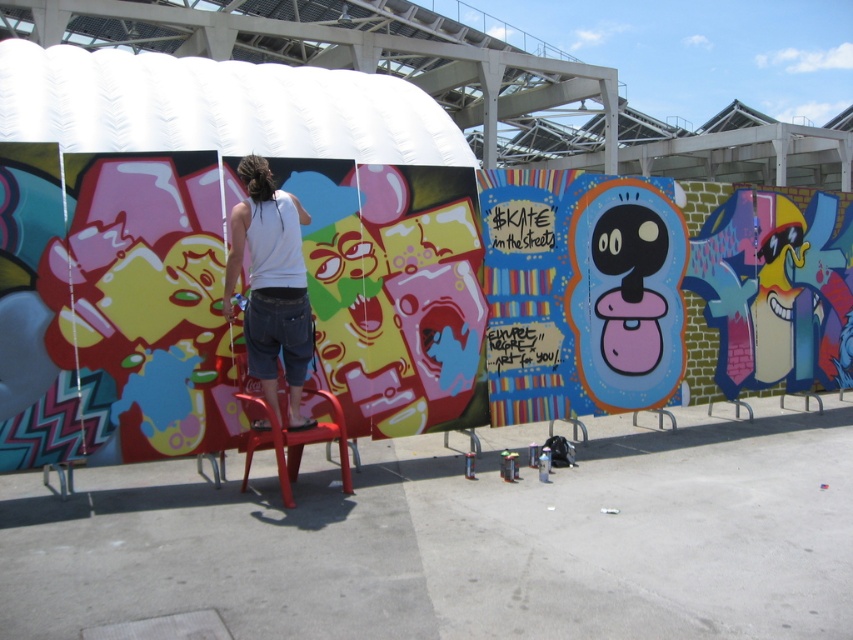
Question: Can you confirm if white cotton tank top at center is positioned to the left of plastic red chair at center?

Choices:
 (A) no
 (B) yes

Answer: (B)

Question: Which point is farther to the camera?

Choices:
 (A) (260, 442)
 (B) (253, 179)

Answer: (A)

Question: Which point is farther to the camera?

Choices:
 (A) [293, 458]
 (B) [256, 301]

Answer: (A)

Question: Which point is closer to the camera?

Choices:
 (A) plastic red chair at center
 (B) white cotton tank top at center

Answer: (A)

Question: Is white cotton tank top at center positioned before plastic red chair at center?

Choices:
 (A) yes
 (B) no

Answer: (B)

Question: Can you confirm if white cotton tank top at center is positioned above plastic red chair at center?

Choices:
 (A) no
 (B) yes

Answer: (B)